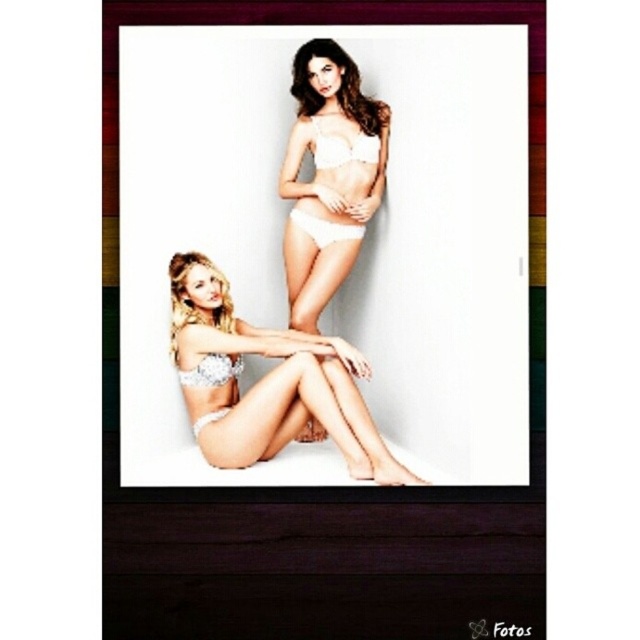
Which of these two, white lace lingerie at lower left or white lace underwear at upper center, stands shorter?

white lace underwear at upper center

How distant is white lace lingerie at lower left from white lace underwear at upper center?

white lace lingerie at lower left and white lace underwear at upper center are 15.34 inches apart from each other.

Who is more forward, (x=305, y=346) or (x=300, y=221)?

Point (x=305, y=346) is more forward.

You are a GUI agent. You are given a task and a screenshot of the screen. Output one action in this format:
    pyautogui.click(x=<x>, y=<y>)
    Task: Click on the white lace lingerie at lower left
    The height and width of the screenshot is (640, 640).
    Given the screenshot: What is the action you would take?
    pyautogui.click(x=266, y=381)

Does white lace lingerie at lower left come behind white matte bikini at upper center?

No, white lace lingerie at lower left is in front of white matte bikini at upper center.

Can you confirm if white lace lingerie at lower left is positioned above white matte bikini at upper center?

Actually, white lace lingerie at lower left is below white matte bikini at upper center.

What do you see at coordinates (266, 381) in the screenshot? The width and height of the screenshot is (640, 640). I see `white lace lingerie at lower left` at bounding box center [266, 381].

Image resolution: width=640 pixels, height=640 pixels. I want to click on white lace lingerie at lower left, so click(x=266, y=381).

Can you confirm if white matte bra at upper center is positioned above white lace bikini top at upper center?

Yes, white matte bra at upper center is above white lace bikini top at upper center.

Does white matte bra at upper center have a larger size compared to white lace bikini top at upper center?

Yes, white matte bra at upper center is bigger than white lace bikini top at upper center.

Is point (355, 70) positioned in front of point (316, 156)?

Yes, it is.

Find the location of a particular element. This screenshot has width=640, height=640. white matte bra at upper center is located at coordinates (337, 88).